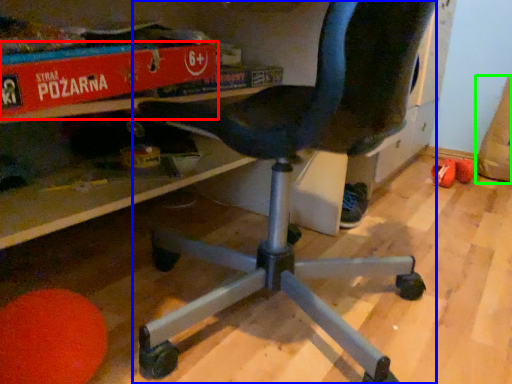
Question: Which is farther away from paperback book (highlighted by a red box)? chair (highlighted by a blue box) or bean bag chair (highlighted by a green box)?

Choices:
 (A) chair
 (B) bean bag chair

Answer: (B)